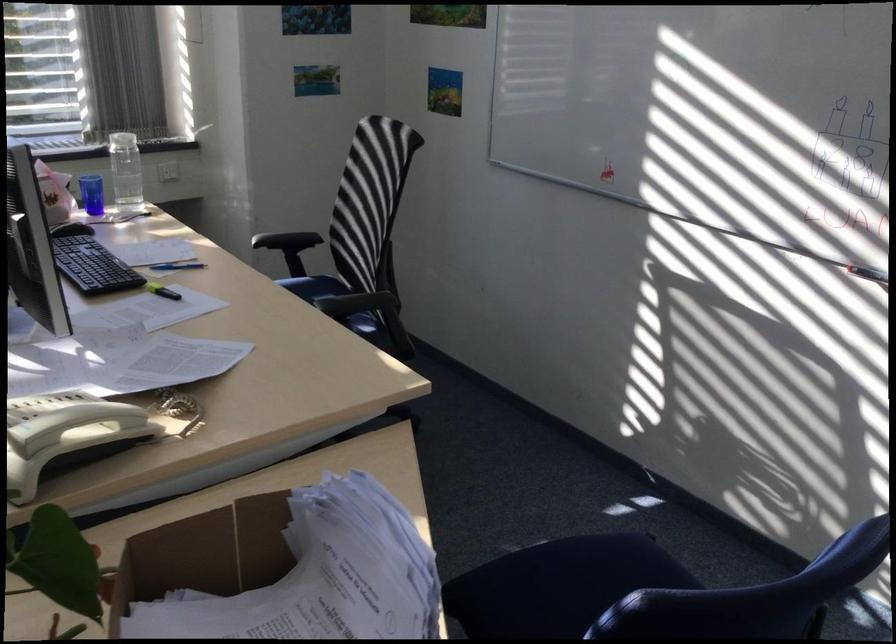
At what (x,y) coordinates should I click in order to perform the action: click on white telephone handset. Please return your answer as a coordinate pair (x, y). The image size is (896, 644). Looking at the image, I should click on (62, 418).